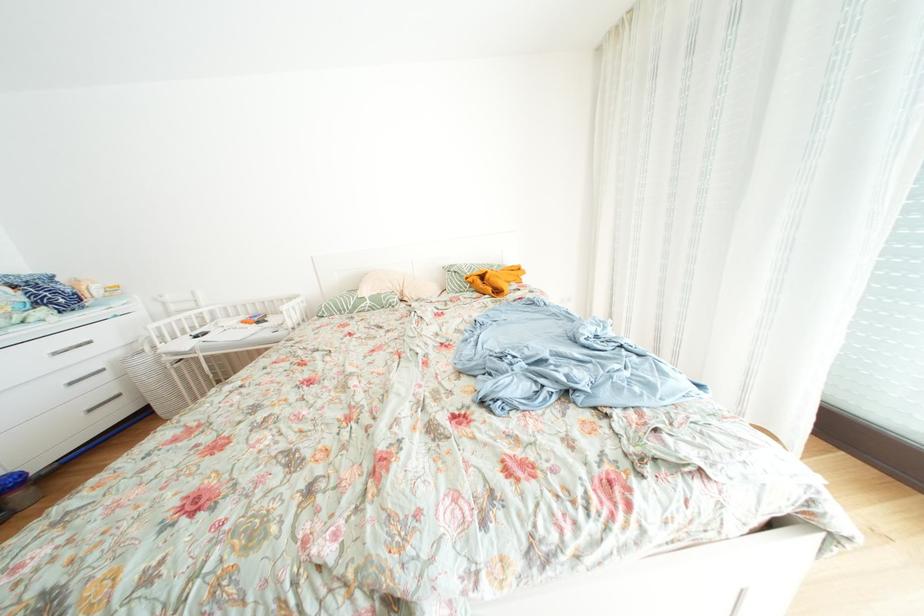
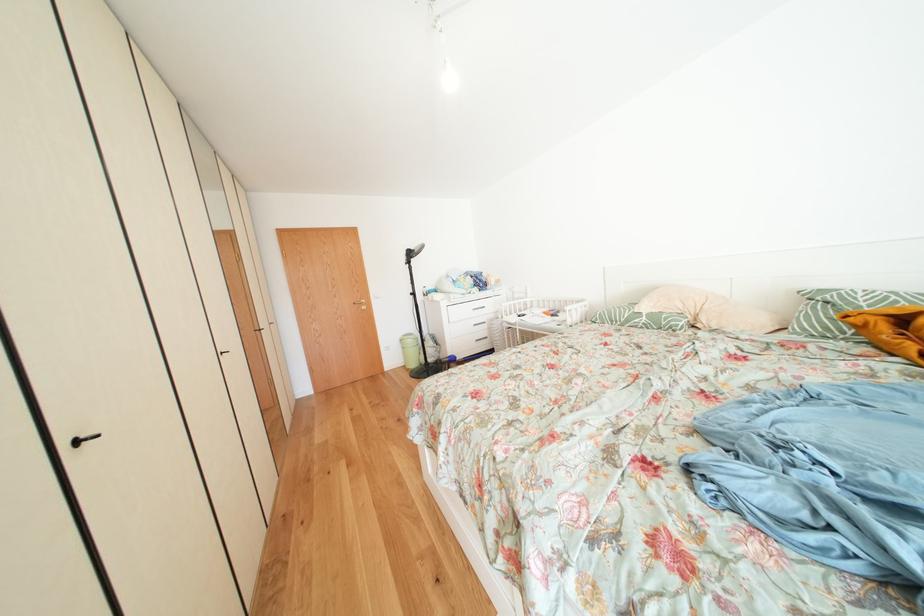
Question: Based on the continuous images, in which direction is the camera rotating? Reply with the corresponding letter.

Choices:
 (A) Left
 (B) Right
 (C) Up
 (D) Down

Answer: (A)